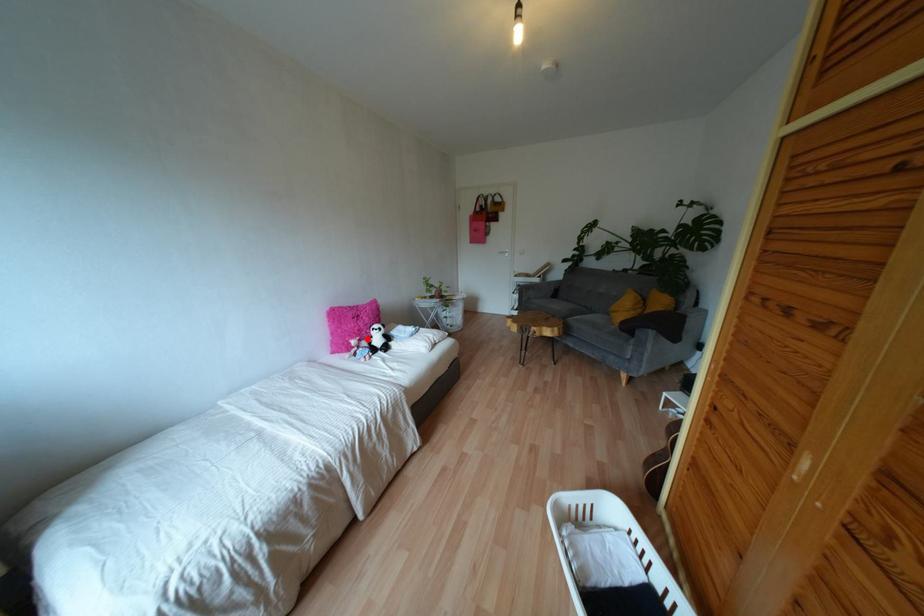
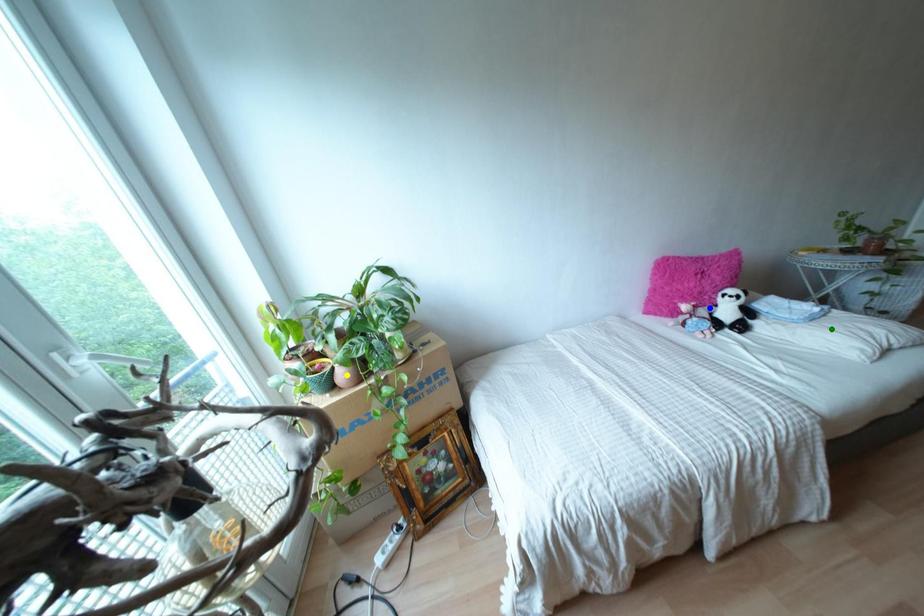
Question: I am providing you with two images of the same scene from different viewpoints. A red point is marked on the first image. You are given multiple points on the second image. Can you choose the point in image 2 that corresponds to the point in image 1?

Choices:
 (A) green point
 (B) blue point
 (C) yellow point

Answer: (B)